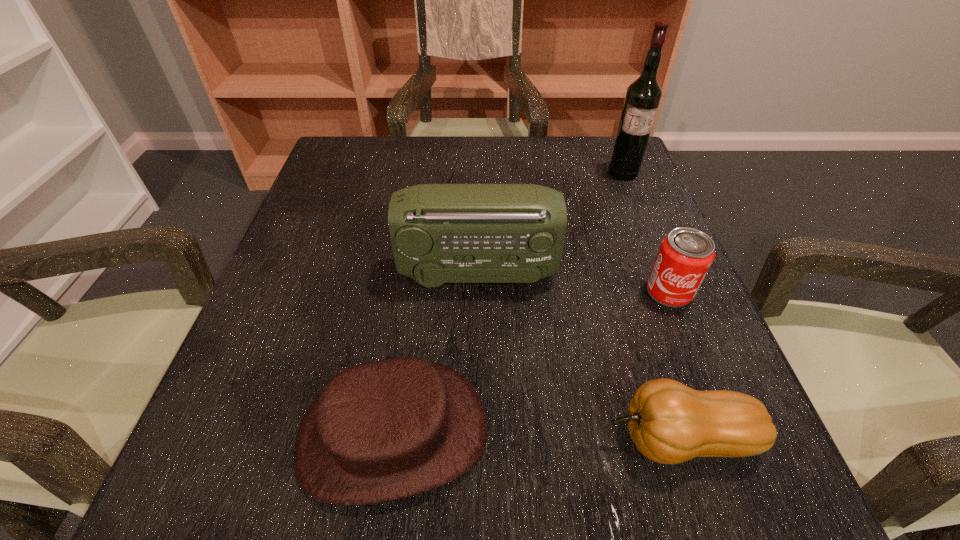
Locate an element on the screen. The width and height of the screenshot is (960, 540). the farthest object is located at coordinates (643, 96).

The height and width of the screenshot is (540, 960). I want to click on wine bottle, so click(x=643, y=96).

At what (x,y) coordinates should I click in order to perform the action: click on radio_receiver. Please return your answer as a coordinate pair (x, y). Image resolution: width=960 pixels, height=540 pixels. Looking at the image, I should click on (440, 233).

This screenshot has height=540, width=960. In order to click on can in this screenshot , I will do `click(685, 255)`.

Find the location of a particular element. This screenshot has width=960, height=540. gourd is located at coordinates (670, 423).

In order to click on hat in this screenshot , I will do click(x=384, y=430).

Image resolution: width=960 pixels, height=540 pixels. In order to click on blank space located 0.210m on the front and back of the tallest object in this screenshot , I will do `click(650, 240)`.

Find the location of a particular element. The width and height of the screenshot is (960, 540). free space located 0.190m on the front-facing side of the radio_receiver is located at coordinates (654, 272).

The height and width of the screenshot is (540, 960). In order to click on vacant space located 0.310m on the front of the can in this screenshot , I will do `click(753, 497)`.

Locate an element on the screen. The image size is (960, 540). vacant space located 0.110m on the stem side of the gourd is located at coordinates (525, 439).